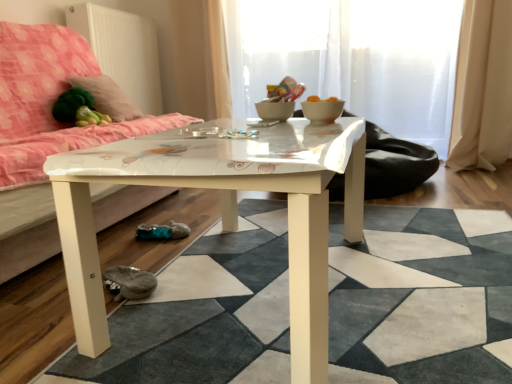
What do you see at coordinates (421, 297) in the screenshot? The height and width of the screenshot is (384, 512). I see `white glossy table at center` at bounding box center [421, 297].

Consider the image. In order to face beige fabric curtain at right, should I rotate leftwards or rightwards?

To align with it, rotate right about 28.726°.

What is the approximate height of matte pink fabric couch at left?

matte pink fabric couch at left is 35.38 inches in height.

Where is `transparent glass door at upper center, the 2th glass door positioned from the front`? The width and height of the screenshot is (512, 384). transparent glass door at upper center, the 2th glass door positioned from the front is located at coordinates (402, 65).

Describe the element at coordinates (223, 210) in the screenshot. I see `white glossy coffee table at center` at that location.

Find the location of a particular element. The width and height of the screenshot is (512, 384). transparent glass door at center, which is the 2th glass door in back-to-front order is located at coordinates (352, 58).

Considering the points (148, 196) and (419, 51), which point is in front, point (148, 196) or point (419, 51)?

Positioned in front is point (148, 196).

Is matte pink fabric couch at left spatially inside transparent glass door at center, which is the 2th glass door in back-to-front order, or outside of it?

matte pink fabric couch at left is spatially situated outside transparent glass door at center, which is the 2th glass door in back-to-front order.

Which is more to the right, matte pink fabric couch at left or transparent glass door at center, which is the first glass door in front-to-back order?

transparent glass door at center, which is the first glass door in front-to-back order, is more to the right.

Between matte pink fabric couch at left and transparent glass door at center, which is the first glass door in front-to-back order, which one has larger size?

With larger size is matte pink fabric couch at left.

From a real-world perspective, which object rests below the other?

From a 3D spatial view, white glossy coffee table at center is below.

Is white glossy coffee table at center positioned with its back to fluffy pink pillow at upper left?

No, white glossy coffee table at center is not facing the opposite direction of fluffy pink pillow at upper left.

Considering the relative sizes of white glossy coffee table at center and fluffy pink pillow at upper left in the image provided, is white glossy coffee table at center wider than fluffy pink pillow at upper left?

Correct, the width of white glossy coffee table at center exceeds that of fluffy pink pillow at upper left.

In the scene shown: Is white glossy coffee table at center completely or partially outside of fluffy pink pillow at upper left?

That's correct, white glossy coffee table at center is outside of fluffy pink pillow at upper left.

Which of these two, white glossy table at center or beige fabric curtain at right, stands taller?

beige fabric curtain at right.

Choose the correct answer: Is white glossy table at center inside beige fabric curtain at right or outside it?

white glossy table at center is spatially situated outside beige fabric curtain at right.

The height and width of the screenshot is (384, 512). I want to click on curtain above the white glossy table at center (from the image's perspective), so click(483, 87).

Is white glossy table at center in contact with beige fabric curtain at right?

No, white glossy table at center is not in contact with beige fabric curtain at right.

From the image's perspective, relative to transparent glass door at upper center, which appears as the 1th glass door when viewed from the back, is fluffy pink pillow at upper left above or below?

Clearly, from the image's perspective, fluffy pink pillow at upper left is below transparent glass door at upper center, which appears as the 1th glass door when viewed from the back.

Considering the positions of objects fluffy pink pillow at upper left and transparent glass door at upper center, which appears as the 1th glass door when viewed from the back, in the image provided, who is behind, fluffy pink pillow at upper left or transparent glass door at upper center, which appears as the 1th glass door when viewed from the back,?

Positioned behind is transparent glass door at upper center, which appears as the 1th glass door when viewed from the back.

Can we say fluffy pink pillow at upper left lies outside transparent glass door at upper center, which appears as the 1th glass door when viewed from the back?

fluffy pink pillow at upper left is positioned outside transparent glass door at upper center, which appears as the 1th glass door when viewed from the back.

In terms of width, does fluffy pink pillow at upper left look wider or thinner when compared to transparent glass door at upper center, the 2th glass door positioned from the front?

fluffy pink pillow at upper left is thinner than transparent glass door at upper center, the 2th glass door positioned from the front.

Is fluffy pink pillow at upper left far away from transparent glass door at center, which is the 2th glass door in back-to-front order?

That's right, there is a large distance between fluffy pink pillow at upper left and transparent glass door at center, which is the 2th glass door in back-to-front order.

Is transparent glass door at center, which is the 2th glass door in back-to-front order, at the back of fluffy pink pillow at upper left?

No, fluffy pink pillow at upper left's orientation is not away from transparent glass door at center, which is the 2th glass door in back-to-front order.

Which is in front, fluffy pink pillow at upper left or transparent glass door at center, which is the first glass door in front-to-back order?

transparent glass door at center, which is the first glass door in front-to-back order, is in front.

How many degrees apart are the facing directions of matte pink fabric couch at left and white glossy coffee table at center?

90 degrees separate the facing orientations of matte pink fabric couch at left and white glossy coffee table at center.

From a real-world perspective, which is physically above, matte pink fabric couch at left or white glossy coffee table at center?

matte pink fabric couch at left.

Find the location of a particular element. Image resolution: width=512 pixels, height=384 pixels. coffee table in front of the matte pink fabric couch at left is located at coordinates (223, 210).

Considering the relative positions of matte pink fabric couch at left and white glossy coffee table at center in the image provided, is matte pink fabric couch at left in front of white glossy coffee table at center?

That is False.

Which is more to the left, gray suede shoe at lower left or fluffy pink pillow at upper left?

From the viewer's perspective, fluffy pink pillow at upper left appears more on the left side.

From the picture: Are gray suede shoe at lower left and fluffy pink pillow at upper left far apart?

Yes, gray suede shoe at lower left and fluffy pink pillow at upper left are located far from each other.

Based on the photo, who is more distant, gray suede shoe at lower left or fluffy pink pillow at upper left?

fluffy pink pillow at upper left.

From the image's perspective, is gray suede shoe at lower left beneath fluffy pink pillow at upper left?

Yes.

The image size is (512, 384). There is a matte pink fabric couch at left. What are the coordinates of `the 1st glass door above it (from the image's perspective)` in the screenshot? It's located at pyautogui.click(x=352, y=58).

Identify the location of pillow behind the white glossy coffee table at center. 108,97.

Looking at this image, estimate the real-world distances between objects in this image. Which object is further from white glossy coffee table at center, white glossy table at center or transparent glass door at upper center, which appears as the 1th glass door when viewed from the back?

transparent glass door at upper center, which appears as the 1th glass door when viewed from the back, is positioned further to the anchor white glossy coffee table at center.

When comparing their distances from white glossy bowl at center, does fluffy pink pillow at upper left or transparent glass door at upper center, which appears as the 1th glass door when viewed from the back, seem closer?

fluffy pink pillow at upper left lies closer to white glossy bowl at center than the other object.

Which object lies nearer to the anchor point gray suede shoe at lower left, matte pink fabric couch at left or transparent glass door at upper center, which appears as the 1th glass door when viewed from the back?

Based on the image, matte pink fabric couch at left appears to be nearer to gray suede shoe at lower left.

Based on the photo, based on their spatial positions, is white glossy bowl at center or gray suede shoe at lower left closer to white glossy coffee table at center?

white glossy bowl at center lies closer to white glossy coffee table at center than the other object.

Which object lies nearer to the anchor point transparent glass door at upper center, the 2th glass door positioned from the front, white glossy table at center or gray suede shoe at lower left?

white glossy table at center is closer to transparent glass door at upper center, the 2th glass door positioned from the front.

Considering their positions, is white glossy bowl at center positioned closer to transparent glass door at center, which is the first glass door in front-to-back order, than gray suede shoe at lower left?

The object closer to transparent glass door at center, which is the first glass door in front-to-back order, is white glossy bowl at center.

Which object lies further to the anchor point white glossy coffee table at center, transparent glass door at center, which is the first glass door in front-to-back order, or white glossy bowl at center?

transparent glass door at center, which is the first glass door in front-to-back order.

Which object lies nearer to the anchor point fluffy pink pillow at upper left, white glossy bowl at center or white glossy table at center?

white glossy bowl at center.

This screenshot has height=384, width=512. What are the coordinates of `shoe located between white glossy table at center and fluffy pink pillow at upper left in the depth direction` in the screenshot? It's located at (128, 282).

Find the location of a particular element. This screenshot has width=512, height=384. coffee table between white glossy table at center and fluffy pink pillow at upper left along the z-axis is located at coordinates (223, 210).

Identify the location of bowl located between white glossy coffee table at center and fluffy pink pillow at upper left in the depth direction. The height and width of the screenshot is (384, 512). (322, 111).

At what (x,y) coordinates should I click in order to perform the action: click on coffee table between gray suede shoe at lower left and beige fabric curtain at right from left to right. Please return your answer as a coordinate pair (x, y). The image size is (512, 384). Looking at the image, I should click on (223, 210).